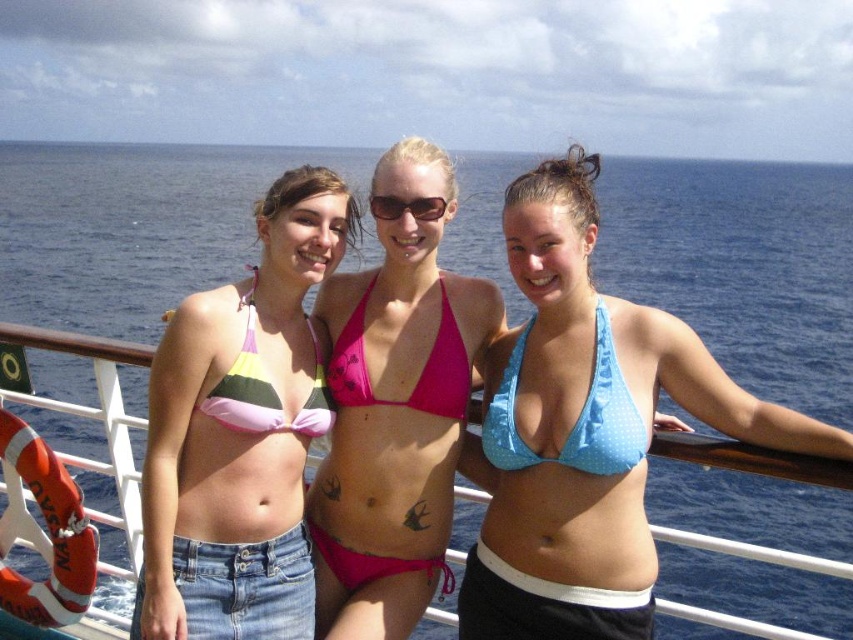
Question: Can you confirm if blue polka dot bikini top at center is positioned to the left of blue polka dot bikini at center?

Choices:
 (A) yes
 (B) no

Answer: (B)

Question: Based on their relative distances, which object is farther from the blue polka dot bikini top at center?

Choices:
 (A) metallic silver boat at center
 (B) shiny plastic sunglasses at center

Answer: (A)

Question: Which point appears closest to the camera in this image?

Choices:
 (A) (799, 442)
 (B) (422, 209)
 (C) (222, 378)

Answer: (A)

Question: Is pink fabric bikini at center to the right of blue polka dot bikini at center from the viewer's perspective?

Choices:
 (A) yes
 (B) no

Answer: (B)

Question: Which point appears farthest from the camera in this image?

Choices:
 (A) (416, 202)
 (B) (711, 621)
 (C) (149, 586)

Answer: (A)

Question: Observing the image, what is the correct spatial positioning of blue polka dot bikini at center in reference to striped fabric bikini top at center?

Choices:
 (A) left
 (B) right

Answer: (B)